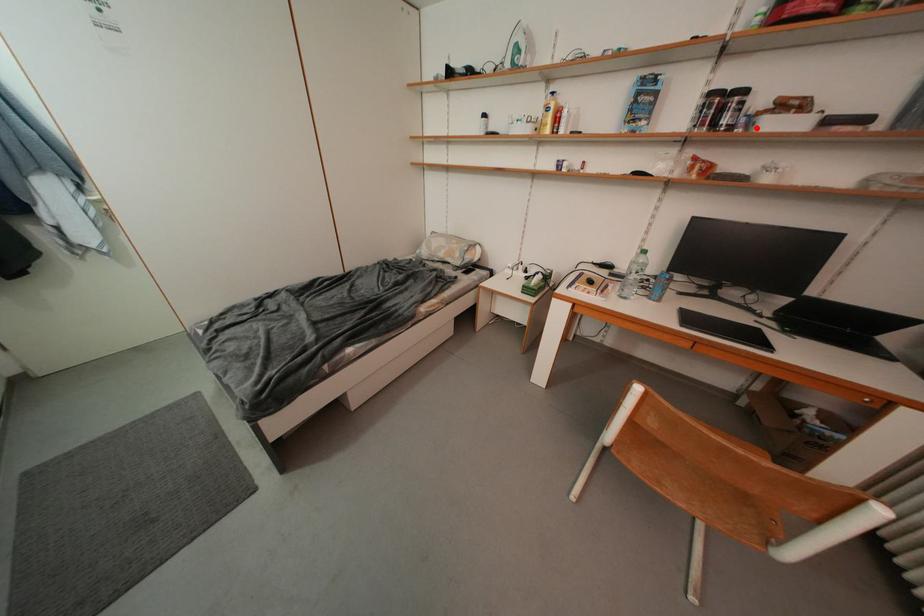
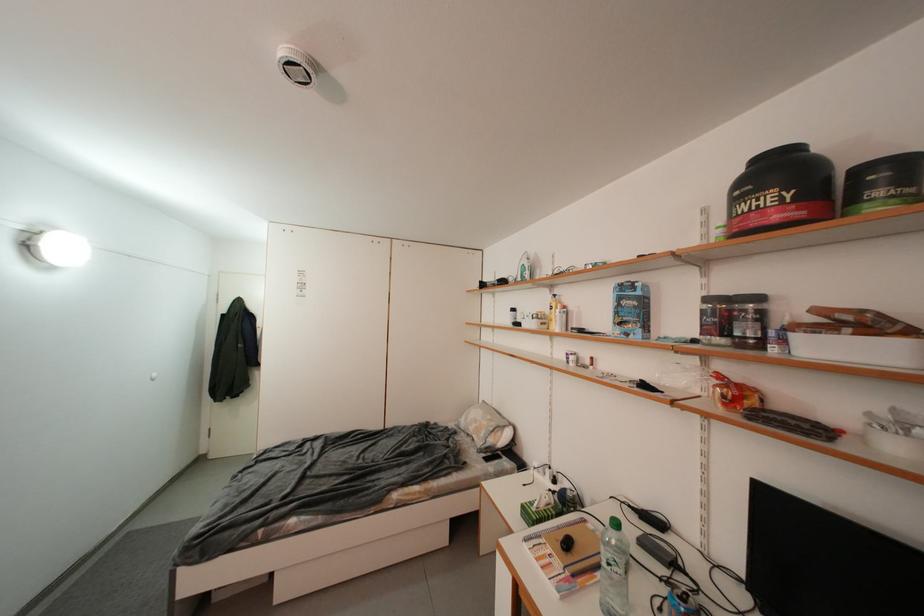
Find the pixel in the second image that matches the highlighted location in the first image.

(792, 345)